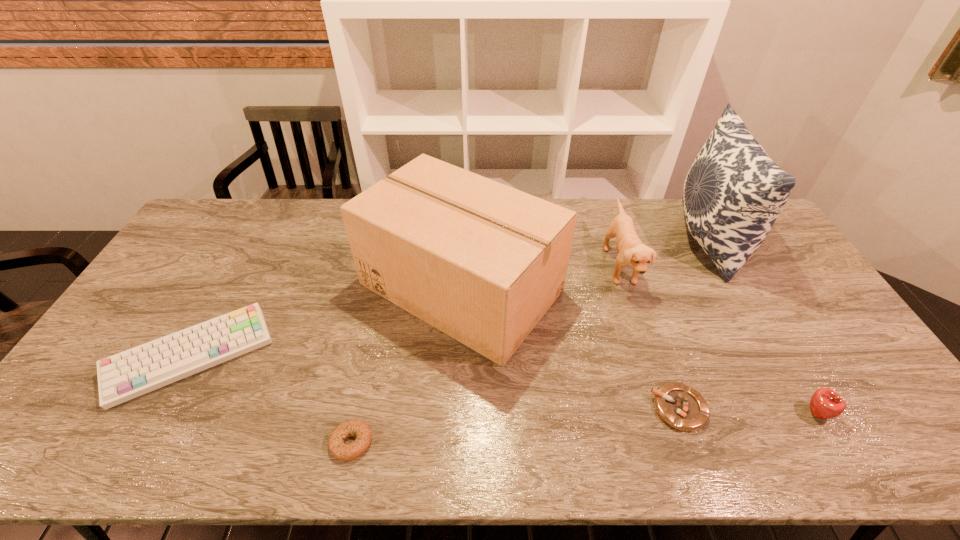
Where is `vacant region located on the front surface of the cushion`? This screenshot has width=960, height=540. vacant region located on the front surface of the cushion is located at coordinates (599, 241).

Where is `free space located 0.120m on the back of the box`? This screenshot has width=960, height=540. free space located 0.120m on the back of the box is located at coordinates (465, 208).

Where is `vacant region located 0.330m on the left side of the puppy`? vacant region located 0.330m on the left side of the puppy is located at coordinates (505, 266).

At what (x,y) coordinates should I click in order to perform the action: click on free space located 0.270m on the left side of the puppy. Please return your answer as a coordinate pair (x, y). The height and width of the screenshot is (540, 960). Looking at the image, I should click on (523, 266).

At what (x,y) coordinates should I click in order to perform the action: click on free space located on the left side of the puppy. Please return your answer as a coordinate pair (x, y). Looking at the image, I should click on (544, 266).

This screenshot has height=540, width=960. What are the coordinates of `blank space located 0.320m on the left of the apple` in the screenshot? It's located at (672, 413).

Identify the location of vacant region located on the right of the leftmost object. The width and height of the screenshot is (960, 540). point(375,356).

Where is `vacant region located 0.360m on the left of the ashtray`? Image resolution: width=960 pixels, height=540 pixels. vacant region located 0.360m on the left of the ashtray is located at coordinates (505, 408).

I want to click on vacant region located 0.190m on the back of the bagel, so click(370, 357).

I want to click on cushion at the far edge, so click(733, 193).